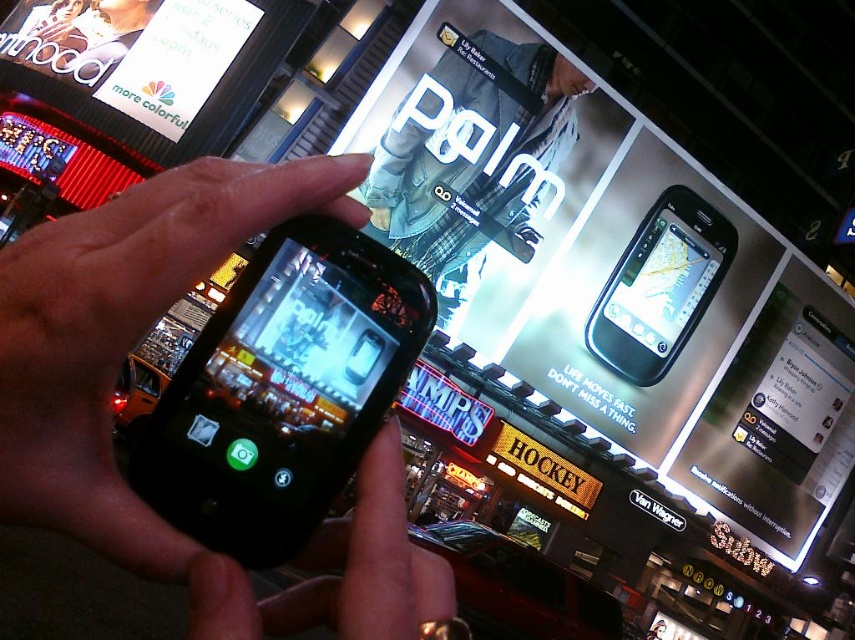
Question: Estimate the real-world distances between objects in this image. Which object is closer to the matte white billboard at upper left?

Choices:
 (A) black glossy phone at upper center
 (B) denim jacket at upper center
 (C) black matte phone at center
 (D) metallic silver phone at center

Answer: (B)

Question: Which point appears closest to the camera in this image?

Choices:
 (A) (408, 250)
 (B) (724, 477)
 (C) (163, 93)
 (D) (688, 288)

Answer: (C)

Question: Is matte white billboard at upper left below black glossy phone at upper center?

Choices:
 (A) yes
 (B) no

Answer: (B)

Question: Is metallic silver phone at center thinner than black matte phone at center?

Choices:
 (A) no
 (B) yes

Answer: (A)

Question: Estimate the real-world distances between objects in this image. Which object is farther from the denim jacket at upper center?

Choices:
 (A) black matte phone at center
 (B) metallic silver phone at center

Answer: (A)

Question: Can you confirm if black matte phone at center is smaller than matte white billboard at upper left?

Choices:
 (A) yes
 (B) no

Answer: (A)